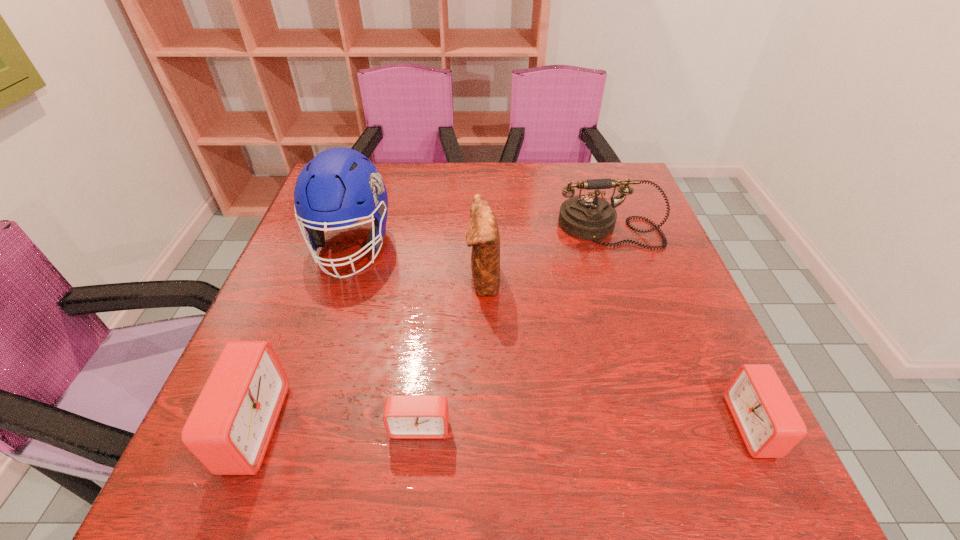
Please point a location where one more alarm_clock can be added evenly. Please provide its 2D coordinates. Your answer should be formatted as a tuple, i.e. [(x, y)], where the tuple contains the x and y coordinates of a point satisfying the conditions above.

[(586, 426)]